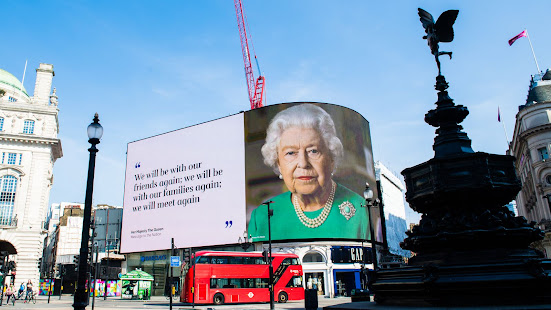
Where is `statue`? Image resolution: width=551 pixels, height=310 pixels. statue is located at coordinates (457, 179).